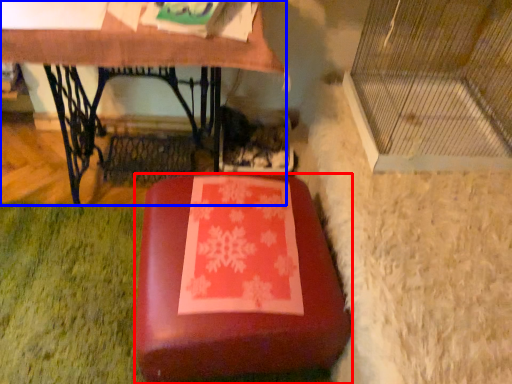
Question: Which point is further to the camera, furniture (highlighted by a red box) or table (highlighted by a blue box)?

Choices:
 (A) furniture
 (B) table

Answer: (B)